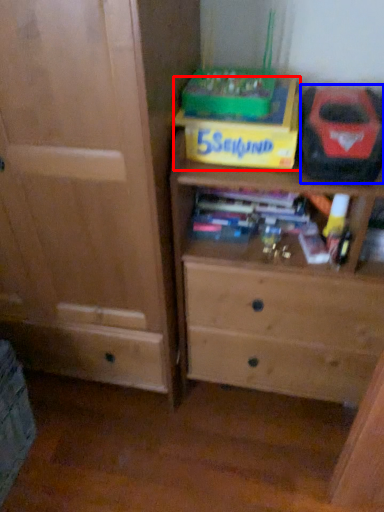
Question: Which point is closer to the camera, cardboard box (highlighted by a red box) or kit (highlighted by a blue box)?

Choices:
 (A) cardboard box
 (B) kit

Answer: (B)